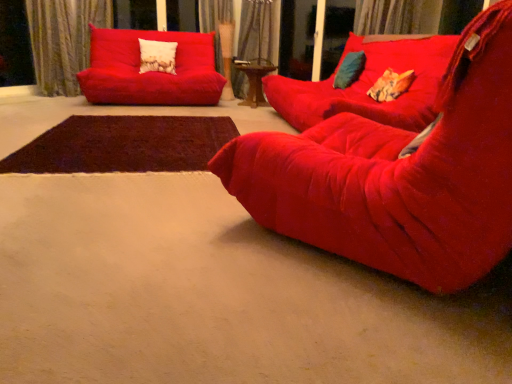
Question: Considering the positions of velvet curtain at upper center, the 3th curtain positioned from the left, and orange fabric pillow at center, positioned as the third pillow in back-to-front order, in the image, is velvet curtain at upper center, the 3th curtain positioned from the left, wider or thinner than orange fabric pillow at center, positioned as the third pillow in back-to-front order,?

Choices:
 (A) thin
 (B) wide

Answer: (B)

Question: Considering their positions, is velvet curtain at upper center, the 3th curtain positioned from the left, located in front of or behind orange fabric pillow at center, positioned as the third pillow in back-to-front order?

Choices:
 (A) behind
 (B) front

Answer: (A)

Question: Which object is positioned farthest from the velvet curtain at upper center, the 3th curtain positioned from the left?

Choices:
 (A) velvet red studio couch at center, which ranks as the 2th studio couch in front-to-back order
 (B) matte red studio couch at upper left, marked as the 3th studio couch in a front-to-back arrangement
 (C) brown shaggy rug at center
 (D) velvet curtain at upper center, the 2th curtain when ordered from left to right
 (E) orange fabric pillow at center, which appears as the 3th pillow when viewed from the top

Answer: (C)

Question: Estimate the real-world distances between objects in this image. Which object is farther from the velvet cushion at upper right?

Choices:
 (A) orange fabric pillow at center, which is the 1th pillow from bottom to top
 (B) matte red studio couch at upper left, marked as the 3th studio couch in a front-to-back arrangement
 (C) brown shaggy rug at center
 (D) velvet curtain at upper left, which appears as the third curtain when viewed from the right
 (E) velvet red studio couch at center, placed as the 2th studio couch when sorted from back to front

Answer: (D)